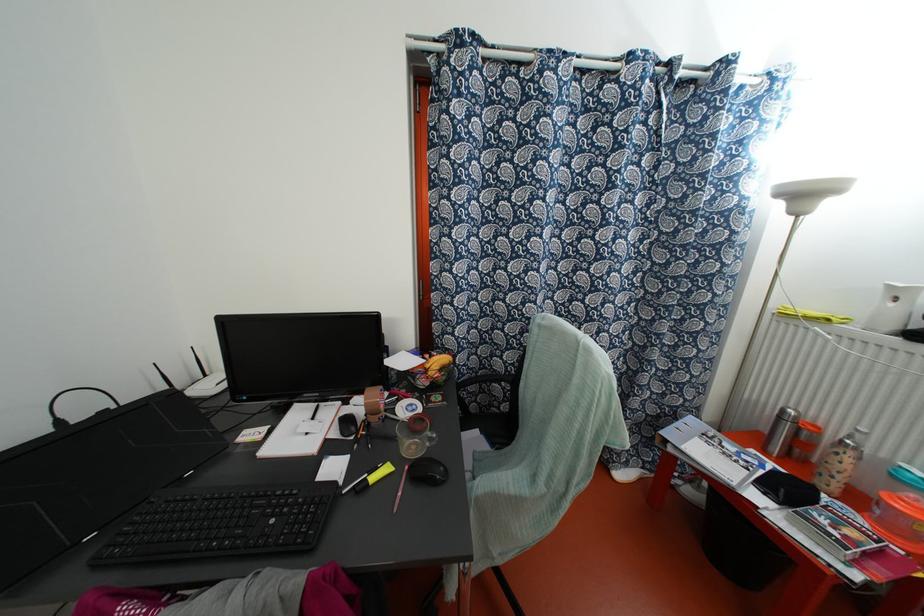
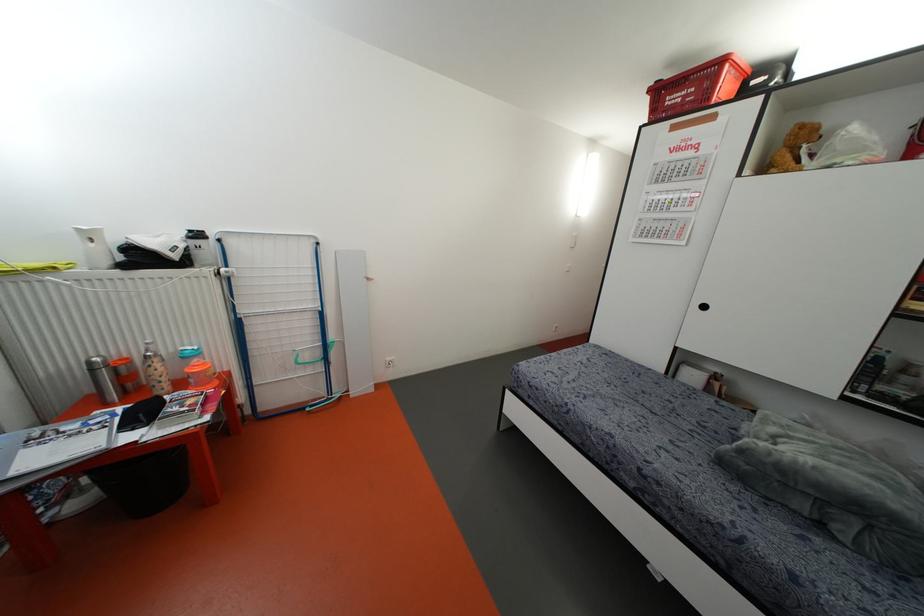
Where in the second image is the point corresponding to point 893,326 from the first image?

(107, 262)